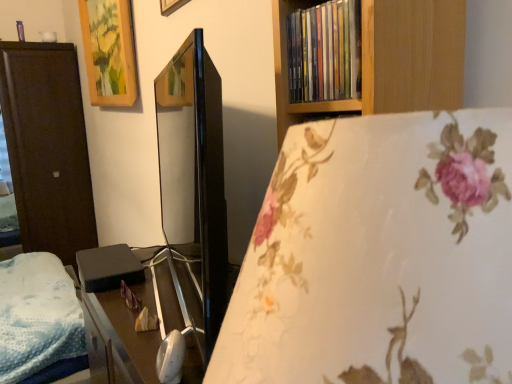
Question: In terms of height, does multicolored plastic books at upper right look taller or shorter compared to black matte/black box at left?

Choices:
 (A) tall
 (B) short

Answer: (A)

Question: Based on their positions, is multicolored plastic books at upper right located to the left or right of black matte/black box at left?

Choices:
 (A) left
 (B) right

Answer: (B)

Question: Which object is the farthest from the black matte/black box at left?

Choices:
 (A) wooden picture frame at upper left
 (B) multicolored plastic books at upper right
 (C) black glossy table at center
 (D) dark wood wardrobe at left

Answer: (D)

Question: Which object is positioned closest to the wooden picture frame at upper left?

Choices:
 (A) dark wood wardrobe at left
 (B) black glossy table at center
 (C) black matte/black box at left
 (D) multicolored plastic books at upper right

Answer: (A)